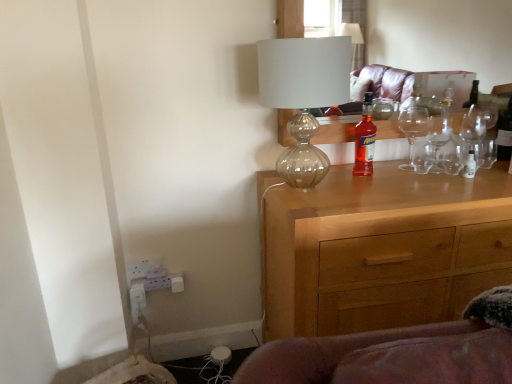
Question: Can you confirm if translucent glass bottle at center, the 2th bottle positioned from the back, is bigger than transparent glass lampshade at upper center?

Choices:
 (A) no
 (B) yes

Answer: (A)

Question: Is translucent glass bottle at center, marked as the 1th bottle in a left-to-right arrangement, to the left of transparent glass lampshade at upper center from the viewer's perspective?

Choices:
 (A) yes
 (B) no

Answer: (B)

Question: Does translucent glass bottle at center, marked as the 1th bottle in a left-to-right arrangement, appear on the right side of transparent glass lampshade at upper center?

Choices:
 (A) yes
 (B) no

Answer: (A)

Question: Does translucent glass bottle at center, placed as the 2th bottle when sorted from right to left, have a lesser width compared to transparent glass lampshade at upper center?

Choices:
 (A) yes
 (B) no

Answer: (A)

Question: Can you confirm if translucent glass bottle at center, the 2th bottle positioned from the back, is shorter than transparent glass lampshade at upper center?

Choices:
 (A) no
 (B) yes

Answer: (B)

Question: From a real-world perspective, relative to translucent glass bottle at center, which is the first bottle from front to back, is transparent glass lampshade at upper center vertically above or below?

Choices:
 (A) below
 (B) above

Answer: (B)

Question: Is transparent glass lampshade at upper center spatially inside translucent glass bottle at center, marked as the 1th bottle in a left-to-right arrangement, or outside of it?

Choices:
 (A) outside
 (B) inside

Answer: (A)

Question: Considering the relative positions of transparent glass lampshade at upper center and translucent glass bottle at center, placed as the 2th bottle when sorted from right to left, in the image provided, is transparent glass lampshade at upper center to the left or to the right of translucent glass bottle at center, placed as the 2th bottle when sorted from right to left,?

Choices:
 (A) left
 (B) right

Answer: (A)

Question: Is point (338, 71) positioned closer to the camera than point (370, 160)?

Choices:
 (A) farther
 (B) closer

Answer: (B)

Question: Choose the correct answer: Is translucent glass bottle at center, placed as the 2th bottle when sorted from right to left, inside wooden chest of drawers at center or outside it?

Choices:
 (A) outside
 (B) inside

Answer: (A)

Question: Is translucent glass bottle at center, marked as the 1th bottle in a left-to-right arrangement, bigger or smaller than wooden chest of drawers at center?

Choices:
 (A) big
 (B) small

Answer: (B)

Question: From their relative heights in the image, would you say translucent glass bottle at center, placed as the 2th bottle when sorted from right to left, is taller or shorter than wooden chest of drawers at center?

Choices:
 (A) tall
 (B) short

Answer: (B)

Question: In terms of width, does translucent glass bottle at center, which is the first bottle from front to back, look wider or thinner when compared to wooden chest of drawers at center?

Choices:
 (A) thin
 (B) wide

Answer: (A)

Question: Considering the positions of point (499, 135) and point (259, 81), is point (499, 135) closer or farther from the camera than point (259, 81)?

Choices:
 (A) closer
 (B) farther

Answer: (B)

Question: Relative to transparent glass lampshade at upper center, is clear glass bottle at upper right, which is the second bottle from front to back, in front or behind?

Choices:
 (A) behind
 (B) front

Answer: (A)